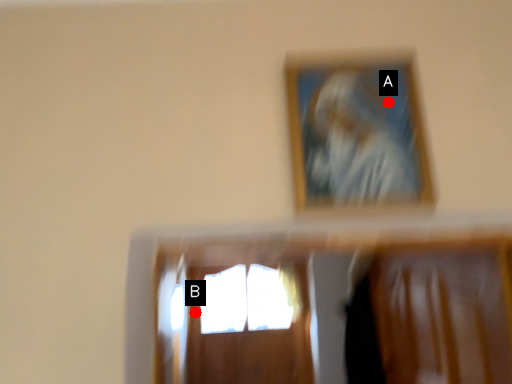
Question: Two points are circled on the image, labeled by A and B beside each circle. Which of the following is the farthest from the observer?

Choices:
 (A) A is further
 (B) B is further

Answer: (B)